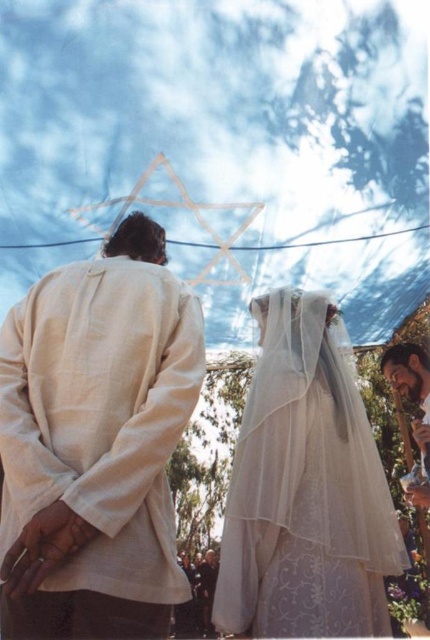
Consider the image. You are standing at the center of the image and want to move towards the light beige linen shirt at center. In which direction should you move?

Since the light beige linen shirt at center is located at point 0.692 on the x axis and 0.223 on the y axis, you should move to the right and slightly downward to reach it.

You are a photographer at the wedding ceremony. You want to capture a photo that includes both the white sheer veil at center and the bearded man at lower right. Which object should you focus on first to ensure both are in sharp focus?

The white sheer veil at center is closer to the viewer than the bearded man at lower right. To ensure both are in sharp focus, focus on the white sheer veil at center first, as it is the closer object, and the bearded man at lower right will fall within the depth of field if the aperture is set appropriately.

You are standing at the point with coordinates point (423, 392) and want to walk to the exit located at point (252, 544). Is there a clear path between these two points?

Yes, there is a clear path between point (252, 544) and point (423, 392) because point (252, 544) is in front of point (423, 392), so you can walk straight towards it without any obstructions.